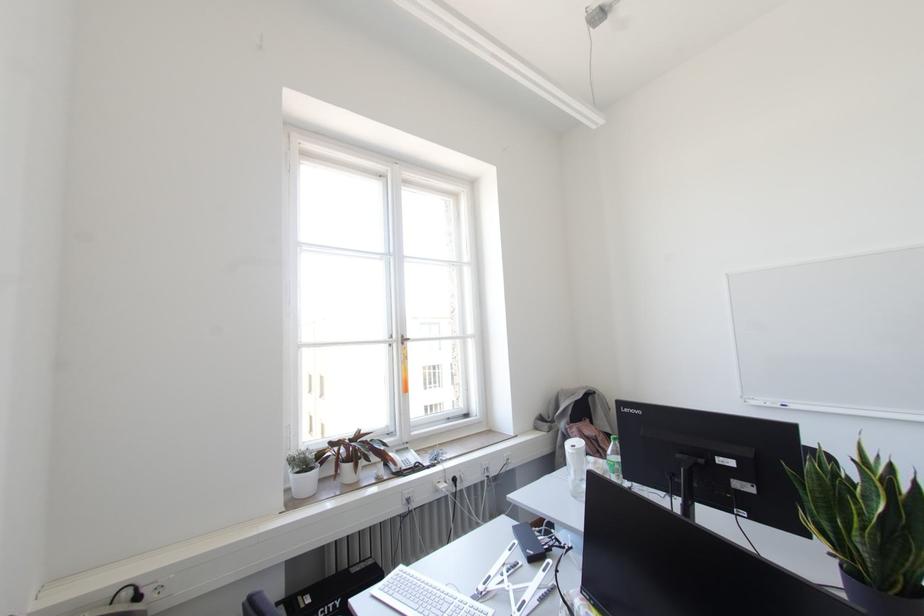
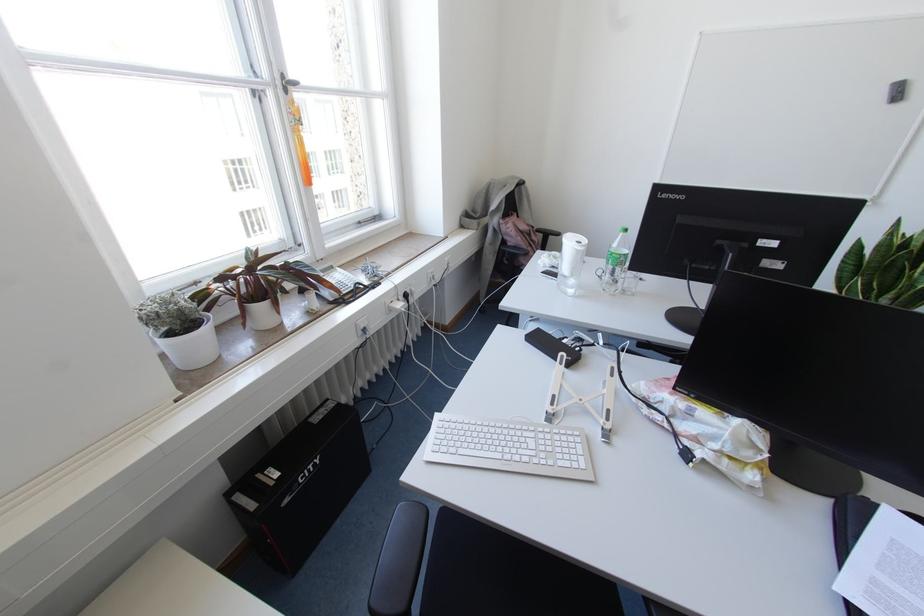
Based on the continuous images, in which direction is the camera rotating?

The camera rotated toward right-down.